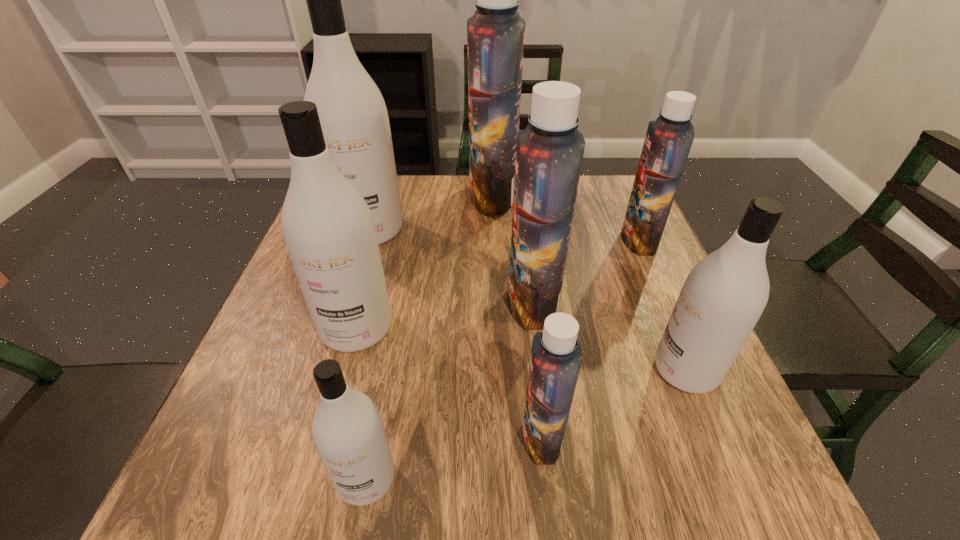
Identify the location of free space that satisfies the following two spatial constraints: 1. on the front label of the third farthest blue shampoo; 2. on the front-facing side of the nearest white shampoo. (555, 478).

The image size is (960, 540). What are the coordinates of `vacant area in the image that satisfies the following two spatial constraints: 1. on the front label of the second smallest blue shampoo; 2. on the front-facing side of the smallest white shampoo` in the screenshot? It's located at (744, 478).

Where is `free space in the image that satisfies the following two spatial constraints: 1. on the front label of the farthest blue shampoo; 2. on the front-facing side of the smallest white shampoo`? This screenshot has height=540, width=960. free space in the image that satisfies the following two spatial constraints: 1. on the front label of the farthest blue shampoo; 2. on the front-facing side of the smallest white shampoo is located at coordinates (503, 478).

This screenshot has height=540, width=960. What are the coordinates of `vacant space that satisfies the following two spatial constraints: 1. on the front label of the biggest blue shampoo; 2. on the front-facing side of the smallest white shampoo` in the screenshot? It's located at (503, 478).